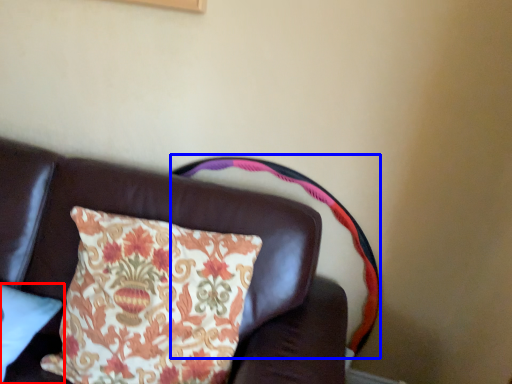
Question: Which point is closer to the camera, pillow (highlighted by a red box) or swivel chair (highlighted by a blue box)?

Choices:
 (A) pillow
 (B) swivel chair

Answer: (A)